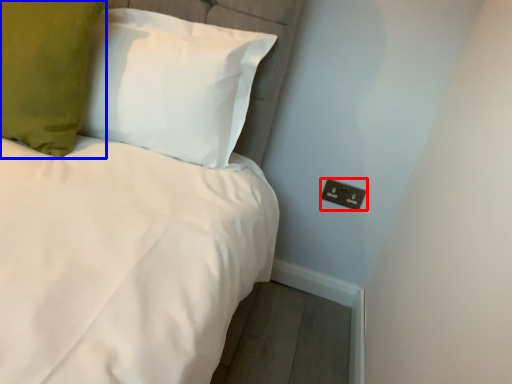
Question: Which of the following is the closest to the observer, electric outlet (highlighted by a red box) or pillow (highlighted by a blue box)?

Choices:
 (A) electric outlet
 (B) pillow

Answer: (B)